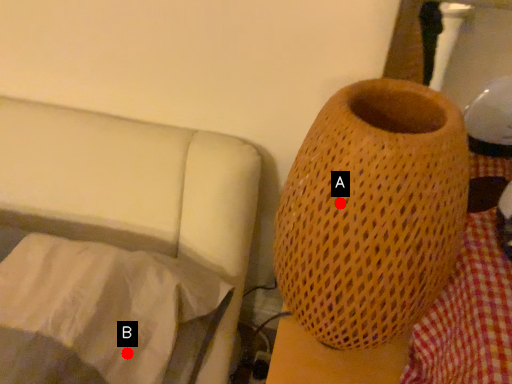
Question: Two points are circled on the image, labeled by A and B beside each circle. Which point is closer to the camera?

Choices:
 (A) A is closer
 (B) B is closer

Answer: (A)